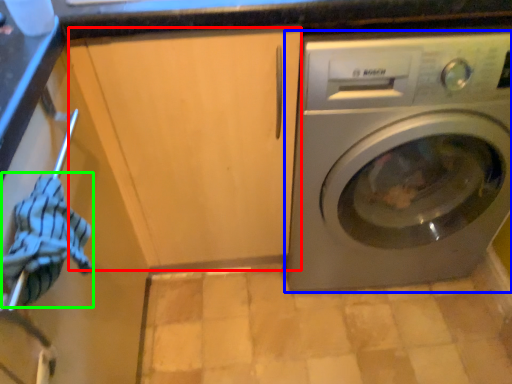
Question: Which object is positioned closest to cabinetry (highlighted by a red box)? Select from washing machine (highlighted by a blue box) and clothing (highlighted by a green box).

Choices:
 (A) washing machine
 (B) clothing

Answer: (A)